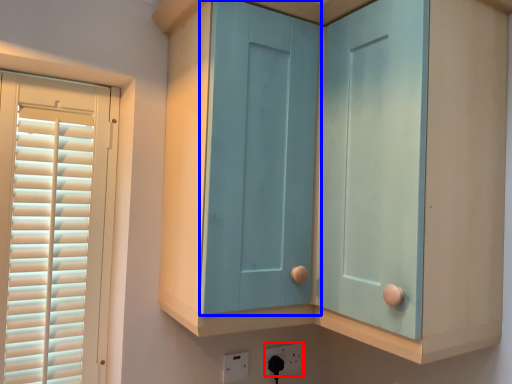
Question: Which of the following is the closest to the observer, electric outlet (highlighted by a red box) or screen door (highlighted by a blue box)?

Choices:
 (A) electric outlet
 (B) screen door

Answer: (B)